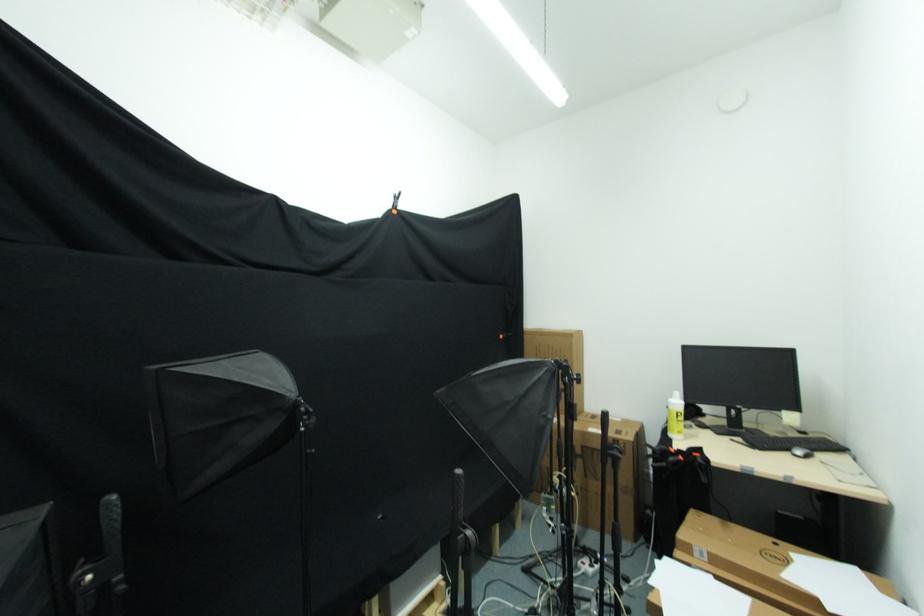
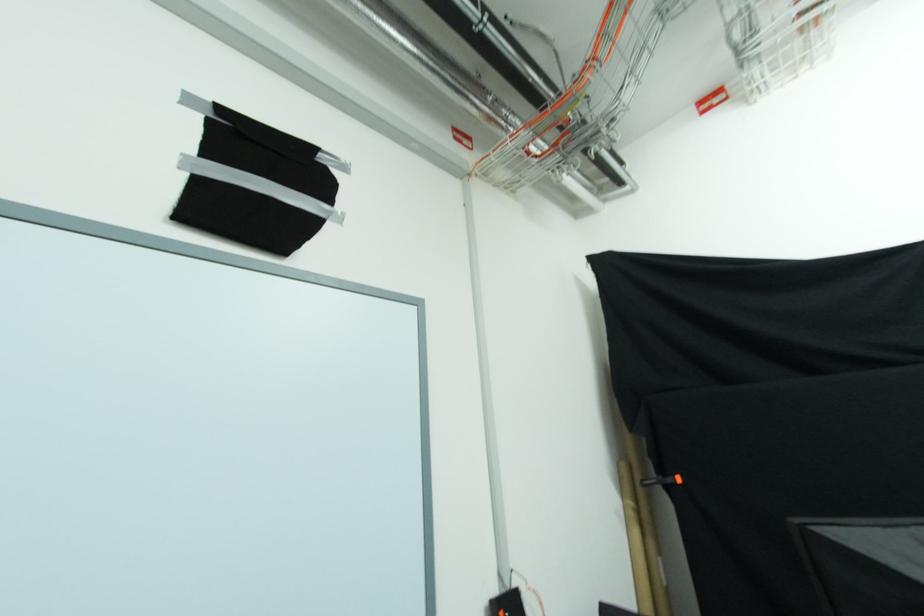
The first image is from the beginning of the video and the second image is from the end. How did the camera likely rotate when shooting the video?

The camera rotated toward left-up.